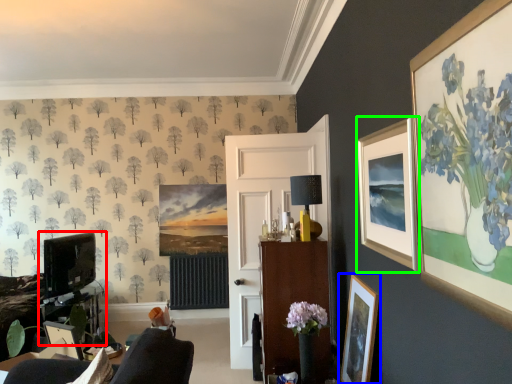
Question: Which is farther away from entertainment center (highlighted by a red box)? picture frame (highlighted by a blue box) or picture frame (highlighted by a green box)?

Choices:
 (A) picture frame
 (B) picture frame

Answer: (B)